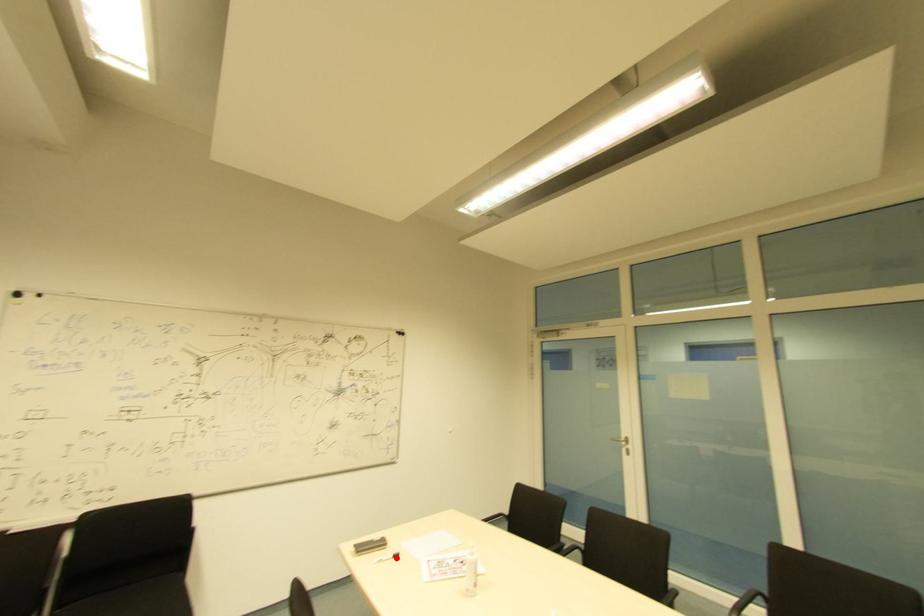
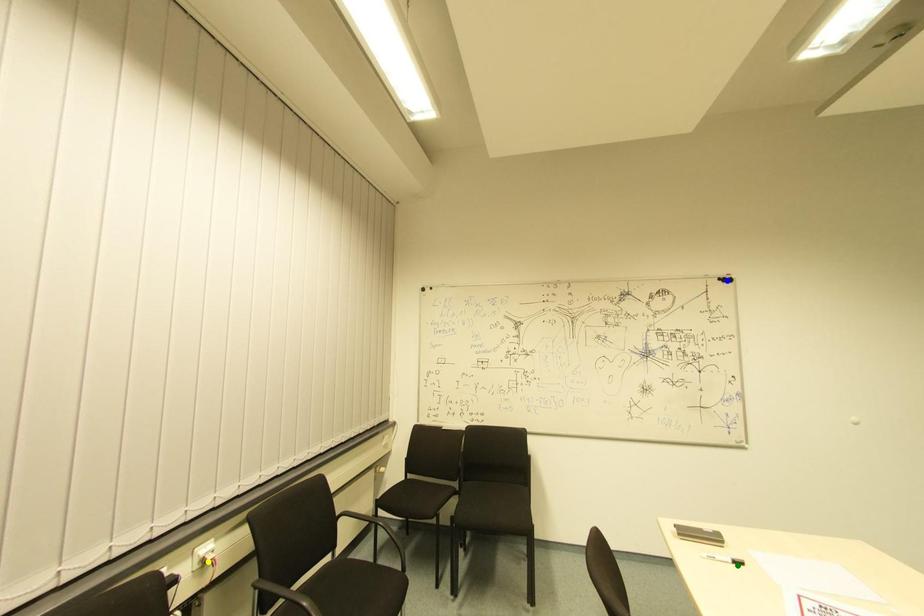
Question: I am providing you with two images of the same scene from different viewpoints. A red point is marked on the first image. You are given multiple points on the second image. Which point in image 2 represents the same 3d spot as the red point in image 1?

Choices:
 (A) blue point
 (B) yellow point
 (C) green point

Answer: (C)